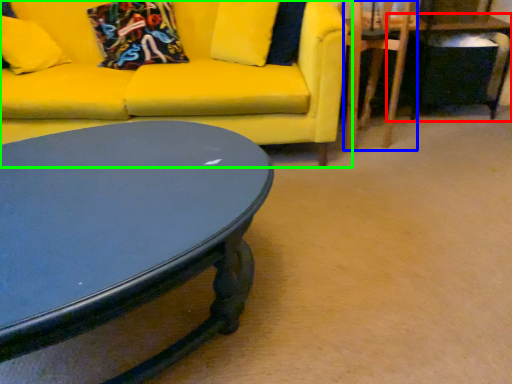
Question: Based on their relative distances, which object is farther from table (highlighted by a red box)? Choose from swivel chair (highlighted by a blue box) and studio couch (highlighted by a green box).

Choices:
 (A) swivel chair
 (B) studio couch

Answer: (B)